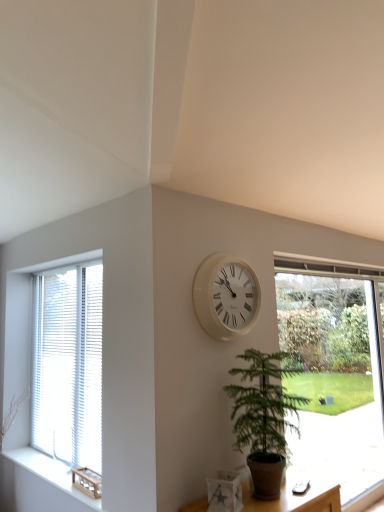
Question: Is white plastic clock at center bigger or smaller than woodenmaterial/texturewindow sill at left?

Choices:
 (A) big
 (B) small

Answer: (A)

Question: Looking at their shapes, would you say white plastic clock at center is wider or thinner than woodenmaterial/texturewindow sill at left?

Choices:
 (A) thin
 (B) wide

Answer: (A)

Question: Considering the real-world distances, which object is farthest from the woodenmaterial/texturewindow sill at left?

Choices:
 (A) transparent glass window at right, arranged as the first window when viewed from the right
 (B) white matte vase at lower center
 (C) white wood blinds at left, acting as the first window starting from the left
 (D) white plastic clock at center
 (E) green leafy plant at center

Answer: (A)

Question: Which object is the farthest from the white wood blinds at left, acting as the first window starting from the left?

Choices:
 (A) transparent glass window at right, arranged as the first window when viewed from the right
 (B) woodenmaterial/texturewindow sill at left
 (C) white plastic clock at center
 (D) white matte vase at lower center
 (E) green leafy plant at center

Answer: (A)